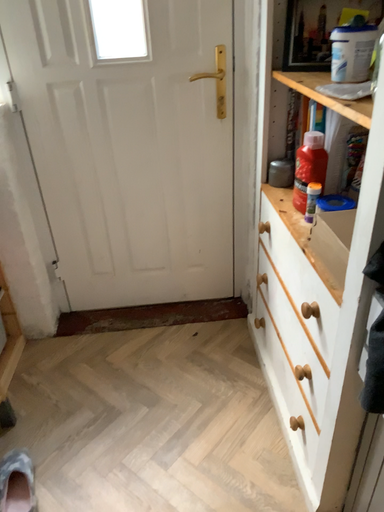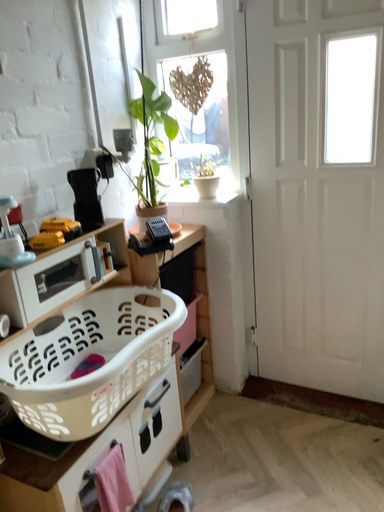
Question: How did the camera likely rotate when shooting the video?

Choices:
 (A) rotated upward
 (B) rotated downward

Answer: (A)